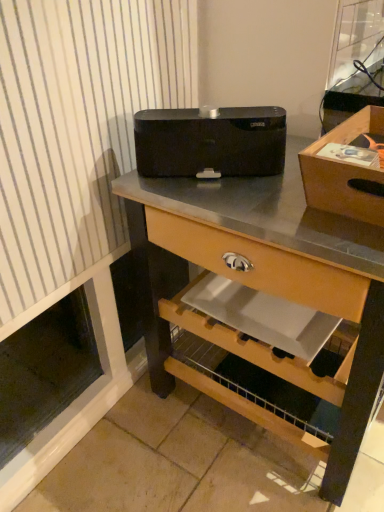
Question: Can you confirm if black matte speaker at center is thinner than black matte speaker at center?

Choices:
 (A) no
 (B) yes

Answer: (A)

Question: Considering the relative sizes of black matte speaker at center and black matte speaker at center in the image provided, is black matte speaker at center wider than black matte speaker at center?

Choices:
 (A) no
 (B) yes

Answer: (B)

Question: Is black matte speaker at center positioned far away from black matte speaker at center?

Choices:
 (A) yes
 (B) no

Answer: (B)

Question: Could you tell me if black matte speaker at center is turned towards black matte speaker at center?

Choices:
 (A) yes
 (B) no

Answer: (B)

Question: From the image's perspective, is black matte speaker at center under black matte speaker at center?

Choices:
 (A) yes
 (B) no

Answer: (A)

Question: Is black matte speaker at center wider or thinner than wooden box at upper right?

Choices:
 (A) thin
 (B) wide

Answer: (A)

Question: From a real-world perspective, is black matte speaker at center physically located above or below wooden box at upper right?

Choices:
 (A) above
 (B) below

Answer: (B)

Question: Is black matte speaker at center situated inside wooden box at upper right or outside?

Choices:
 (A) outside
 (B) inside

Answer: (A)

Question: Relative to wooden box at upper right, is black matte speaker at center in front or behind?

Choices:
 (A) behind
 (B) front

Answer: (A)

Question: From their relative heights in the image, would you say wooden box at upper right is taller or shorter than black matte speaker at center?

Choices:
 (A) short
 (B) tall

Answer: (A)

Question: Is wooden box at upper right bigger or smaller than black matte speaker at center?

Choices:
 (A) big
 (B) small

Answer: (B)

Question: Visually, is wooden box at upper right positioned to the left or to the right of black matte speaker at center?

Choices:
 (A) left
 (B) right

Answer: (B)

Question: Considering the positions of point (382, 131) and point (336, 450), is point (382, 131) closer or farther from the camera than point (336, 450)?

Choices:
 (A) closer
 (B) farther

Answer: (A)

Question: Based on their sizes in the image, would you say black matte speaker at center is bigger or smaller than black matte speaker at center?

Choices:
 (A) big
 (B) small

Answer: (B)

Question: Choose the correct answer: Is black matte speaker at center inside black matte speaker at center or outside it?

Choices:
 (A) outside
 (B) inside

Answer: (A)